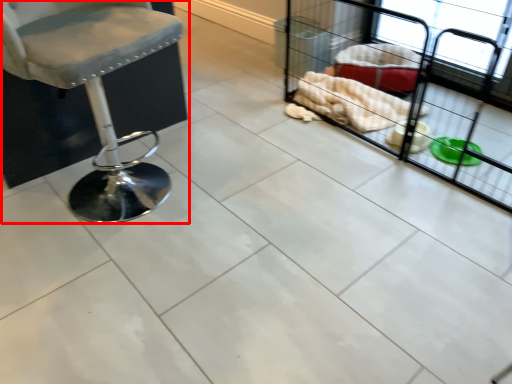
Question: Observing the image, what is the correct spatial positioning of chair (annotated by the red box) in reference to baby carriage?

Choices:
 (A) left
 (B) right

Answer: (A)